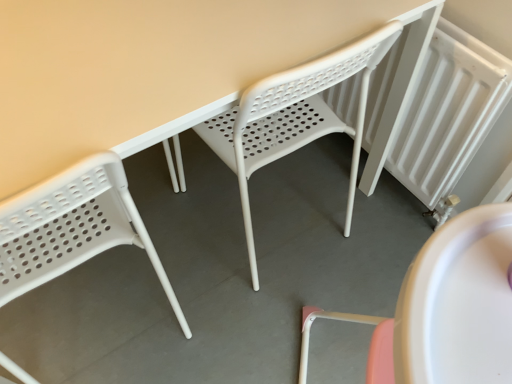
What is the approximate width of white textured radiator at right?

white textured radiator at right is 3.59 inches wide.

What is the approximate height of white plastic chair at center, which is counted as the second chair, starting from the left?

The height of white plastic chair at center, which is counted as the second chair, starting from the left, is 78.87 centimeters.

Image resolution: width=512 pixels, height=384 pixels. What are the coordinates of `white plastic chair at left, which is counted as the 2th chair, starting from the right` in the screenshot? It's located at (72, 228).

Is point (227, 117) farther from viewer compared to point (479, 66)?

Yes, point (227, 117) is farther from viewer.

From a real-world perspective, which object rests below the other?

From a 3D spatial view, white textured radiator at right is below.

Is white plastic chair at center, which appears as the 1th chair when viewed from the right, looking in the opposite direction of white textured radiator at right?

white plastic chair at center, which appears as the 1th chair when viewed from the right, does not have its back to white textured radiator at right.

Is white textured radiator at right completely or partially inside white plastic chair at center, which appears as the 1th chair when viewed from the right?

That's incorrect, white textured radiator at right is not inside white plastic chair at center, which appears as the 1th chair when viewed from the right.

Is white plastic chair at center, which appears as the 1th chair when viewed from the right, directly adjacent to white plastic chair at left, arranged as the 1th chair when viewed from the left?

No, white plastic chair at center, which appears as the 1th chair when viewed from the right, is not with white plastic chair at left, arranged as the 1th chair when viewed from the left.

How much distance is there between white plastic chair at center, which appears as the 1th chair when viewed from the right, and white plastic chair at left, arranged as the 1th chair when viewed from the left?

white plastic chair at center, which appears as the 1th chair when viewed from the right, and white plastic chair at left, arranged as the 1th chair when viewed from the left, are 15.59 inches apart from each other.

Between white plastic chair at center, which is counted as the second chair, starting from the left, and white plastic chair at left, which is counted as the 2th chair, starting from the right, which one appears on the right side from the viewer's perspective?

white plastic chair at center, which is counted as the second chair, starting from the left.

In the scene shown: Between white plastic chair at center, which appears as the 1th chair when viewed from the right, and white plastic chair at left, which is counted as the 2th chair, starting from the right, which one has smaller width?

With smaller width is white plastic chair at left, which is counted as the 2th chair, starting from the right.

Does white textured radiator at right appear on the right side of white plastic chair at center, which appears as the 1th chair when viewed from the right?

Indeed, white textured radiator at right is positioned on the right side of white plastic chair at center, which appears as the 1th chair when viewed from the right.

What's the angular difference between white textured radiator at right and white plastic chair at center, which appears as the 1th chair when viewed from the right,'s facing directions?

The facing directions of white textured radiator at right and white plastic chair at center, which appears as the 1th chair when viewed from the right, are 90.5 degrees apart.

Does white textured radiator at right turn towards white plastic chair at center, which is counted as the second chair, starting from the left?

Yes, white textured radiator at right is aimed at white plastic chair at center, which is counted as the second chair, starting from the left.

You are a GUI agent. You are given a task and a screenshot of the screen. Output one action in this format:
    pyautogui.click(x=<x>, y=<y>)
    Task: Click on the radiator below the white plastic chair at center, which is counted as the second chair, starting from the left (from a real-world perspective)
    The width and height of the screenshot is (512, 384).
    Given the screenshot: What is the action you would take?
    pyautogui.click(x=448, y=116)

From the image's perspective, would you say white textured radiator at right is positioned over white plastic chair at left, which is counted as the 2th chair, starting from the right?

Yes, from the image's perspective, white textured radiator at right is on top of white plastic chair at left, which is counted as the 2th chair, starting from the right.

From the picture: Does white textured radiator at right have a larger size compared to white plastic chair at left, which is counted as the 2th chair, starting from the right?

No.

Is white textured radiator at right not near white plastic chair at left, arranged as the 1th chair when viewed from the left?

No, there isn't a large distance between white textured radiator at right and white plastic chair at left, arranged as the 1th chair when viewed from the left.

How distant is white textured radiator at right from white plastic chair at left, arranged as the 1th chair when viewed from the left?

33.43 inches.

Which of these two, white plastic chair at left, which is counted as the 2th chair, starting from the right, or white plastic chair at center, which is counted as the second chair, starting from the left, stands shorter?

white plastic chair at left, which is counted as the 2th chair, starting from the right.

Which object is further away from the camera, white plastic chair at left, which is counted as the 2th chair, starting from the right, or white plastic chair at center, which is counted as the second chair, starting from the left?

Positioned behind is white plastic chair at center, which is counted as the second chair, starting from the left.

Does white plastic chair at left, arranged as the 1th chair when viewed from the left, have a smaller size compared to white plastic chair at center, which appears as the 1th chair when viewed from the right?

Yes, white plastic chair at left, arranged as the 1th chair when viewed from the left, is smaller than white plastic chair at center, which appears as the 1th chair when viewed from the right.

Which is less distant, (130, 239) or (383, 51)?

Clearly, point (130, 239) is more distant from the camera than point (383, 51).

From the image's perspective, is white plastic chair at left, which is counted as the 2th chair, starting from the right, beneath white textured radiator at right?

Yes.

Considering the sizes of objects white plastic chair at left, which is counted as the 2th chair, starting from the right, and white textured radiator at right in the image provided, who is smaller, white plastic chair at left, which is counted as the 2th chair, starting from the right, or white textured radiator at right?

white textured radiator at right is smaller.

From a real-world perspective, which object stands above the other?

white plastic chair at left, arranged as the 1th chair when viewed from the left, is physically above.

Is white textured radiator at right surrounded by white plastic chair at left, arranged as the 1th chair when viewed from the left?

No, white textured radiator at right is not inside white plastic chair at left, arranged as the 1th chair when viewed from the left.

This screenshot has height=384, width=512. I want to click on the 1st chair counting from the left side of the white textured radiator at right, so click(x=294, y=118).

I want to click on chair in front of the white plastic chair at center, which appears as the 1th chair when viewed from the right, so click(72, 228).

Considering their positions, is white textured radiator at right positioned closer to white plastic chair at left, which is counted as the 2th chair, starting from the right, than white plastic chair at center, which appears as the 1th chair when viewed from the right?

white plastic chair at center, which appears as the 1th chair when viewed from the right, is positioned closer to the anchor white plastic chair at left, which is counted as the 2th chair, starting from the right.

From the image, which object appears to be farther from white plastic chair at center, which is counted as the second chair, starting from the left, white plastic chair at left, which is counted as the 2th chair, starting from the right, or white textured radiator at right?

white plastic chair at left, which is counted as the 2th chair, starting from the right, lies further to white plastic chair at center, which is counted as the second chair, starting from the left, than the other object.

Based on their spatial positions, is white plastic chair at center, which is counted as the second chair, starting from the left, or white plastic chair at left, arranged as the 1th chair when viewed from the left, closer to white textured radiator at right?

white plastic chair at center, which is counted as the second chair, starting from the left, is positioned closer to the anchor white textured radiator at right.

When comparing their distances from white textured radiator at right, does white plastic chair at left, arranged as the 1th chair when viewed from the left, or white plastic chair at center, which appears as the 1th chair when viewed from the right, seem further?

white plastic chair at left, arranged as the 1th chair when viewed from the left, is further to white textured radiator at right.

Estimate the real-world distances between objects in this image. Which object is further from white plastic chair at left, which is counted as the 2th chair, starting from the right, white plastic chair at center, which is counted as the second chair, starting from the left, or white textured radiator at right?

The object further to white plastic chair at left, which is counted as the 2th chair, starting from the right, is white textured radiator at right.

Estimate the real-world distances between objects in this image. Which object is closer to white plastic chair at center, which appears as the 1th chair when viewed from the right, white textured radiator at right or white plastic chair at left, arranged as the 1th chair when viewed from the left?

white textured radiator at right is positioned closer to the anchor white plastic chair at center, which appears as the 1th chair when viewed from the right.

Locate an element on the screen. Image resolution: width=512 pixels, height=384 pixels. chair between white plastic chair at left, which is counted as the 2th chair, starting from the right, and white textured radiator at right, in the horizontal direction is located at coordinates (294, 118).